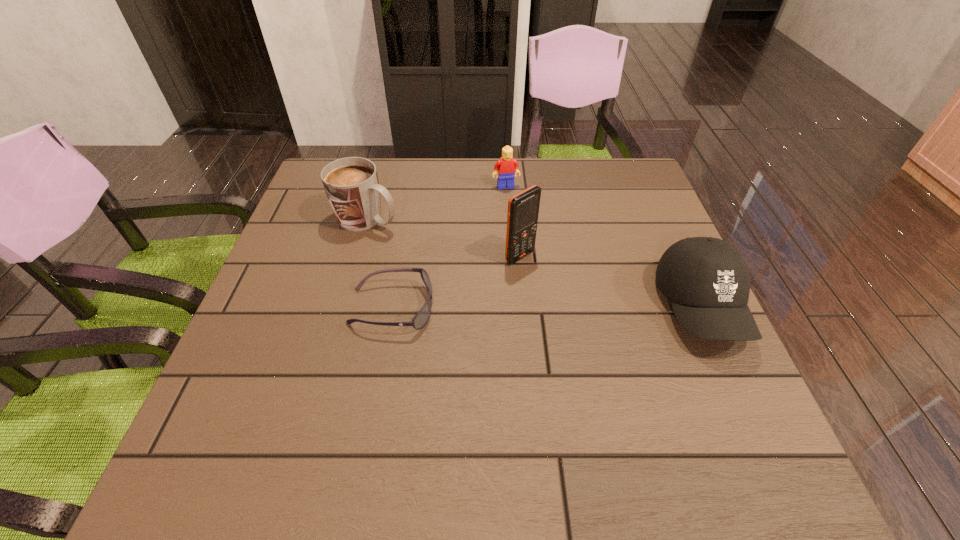
This screenshot has width=960, height=540. Find the location of `object that is at the far left corner`. object that is at the far left corner is located at coordinates (351, 184).

The height and width of the screenshot is (540, 960). I want to click on blank area at the far edge, so click(x=396, y=194).

In the image, there is a desktop. Where is `vacant space at the near edge`? The image size is (960, 540). vacant space at the near edge is located at coordinates (589, 392).

The width and height of the screenshot is (960, 540). In the image, there is a desktop. Identify the location of vacant space at the left edge. (334, 259).

The width and height of the screenshot is (960, 540). In the image, there is a desktop. Identify the location of blank space at the right edge. (633, 223).

This screenshot has width=960, height=540. What are the coordinates of `free space at the far left corner of the desktop` in the screenshot? It's located at (370, 160).

In the image, there is a desktop. What are the coordinates of `vacant area at the far right corner` in the screenshot? It's located at (654, 193).

The height and width of the screenshot is (540, 960). In order to click on free space that is in between the sunglasses and the cellular telephone in this screenshot , I will do `click(456, 282)`.

In order to click on vacant point located between the baseball cap and the second farthest object in this screenshot , I will do `click(535, 263)`.

The width and height of the screenshot is (960, 540). What are the coordinates of `vacant space that is in between the mug and the tallest object` in the screenshot? It's located at pyautogui.click(x=444, y=238).